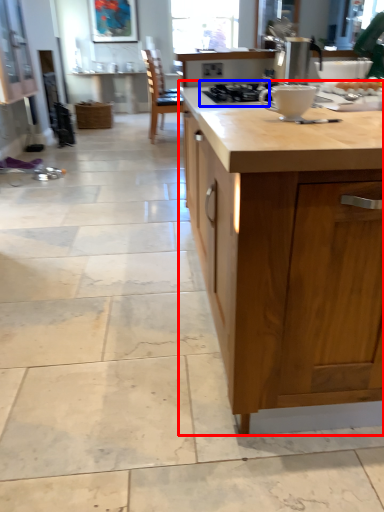
Question: Which object is further to the camera taking this photo, countertop (highlighted by a red box) or gas stove (highlighted by a blue box)?

Choices:
 (A) countertop
 (B) gas stove

Answer: (B)